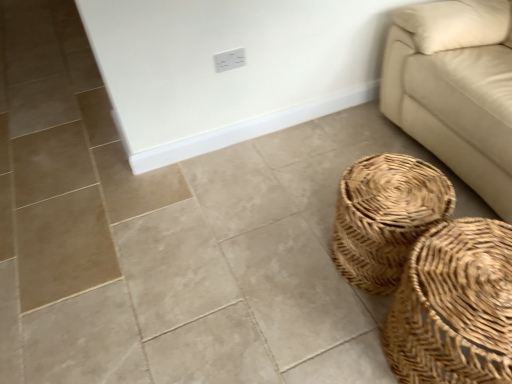
Question: Considering the relative positions of woven natural basket at lower right, which appears as the first basket when viewed from the back, and woven natural basket at lower right, which is the 1th basket from front to back, in the image provided, is woven natural basket at lower right, which appears as the first basket when viewed from the back, in front of woven natural basket at lower right, which is the 1th basket from front to back,?

Choices:
 (A) yes
 (B) no

Answer: (B)

Question: Can you confirm if woven natural basket at lower right, which appears as the first basket when viewed from the back, is positioned to the left of woven natural basket at lower right, which is the 1th basket from front to back?

Choices:
 (A) no
 (B) yes

Answer: (B)

Question: Can you confirm if woven natural basket at lower right, the second basket viewed from the front, is thinner than woven natural basket at lower right, which is the 1th basket from front to back?

Choices:
 (A) no
 (B) yes

Answer: (B)

Question: Is woven natural basket at lower right, which appears as the first basket when viewed from the back, at the right side of woven natural basket at lower right, positioned as the 2th basket in back-to-front order?

Choices:
 (A) no
 (B) yes

Answer: (A)

Question: Is woven natural basket at lower right, which appears as the first basket when viewed from the back, bigger than woven natural basket at lower right, which is the 1th basket from front to back?

Choices:
 (A) no
 (B) yes

Answer: (A)

Question: From the image's perspective, relative to beige leather couch at right, is white plastic electric outlet at upper center above or below?

Choices:
 (A) above
 (B) below

Answer: (A)

Question: Relative to beige leather couch at right, is white plastic electric outlet at upper center in front or behind?

Choices:
 (A) front
 (B) behind

Answer: (B)

Question: From a real-world perspective, is white plastic electric outlet at upper center above or below beige leather couch at right?

Choices:
 (A) above
 (B) below

Answer: (A)

Question: Considering the positions of point (215, 62) and point (436, 41), is point (215, 62) closer or farther from the camera than point (436, 41)?

Choices:
 (A) farther
 (B) closer

Answer: (A)

Question: In the image, is beige leather couch at right on the left side or the right side of woven natural basket at lower right, which is the 1th basket from front to back?

Choices:
 (A) left
 (B) right

Answer: (B)

Question: Choose the correct answer: Is beige leather couch at right inside woven natural basket at lower right, positioned as the 2th basket in back-to-front order, or outside it?

Choices:
 (A) inside
 (B) outside

Answer: (B)

Question: From a real-world perspective, is beige leather couch at right above or below woven natural basket at lower right, positioned as the 2th basket in back-to-front order?

Choices:
 (A) below
 (B) above

Answer: (B)

Question: Is point (464, 11) closer or farther from the camera than point (460, 273)?

Choices:
 (A) farther
 (B) closer

Answer: (A)

Question: Is point (360, 254) positioned closer to the camera than point (224, 51)?

Choices:
 (A) closer
 (B) farther

Answer: (A)

Question: Considering the positions of woven natural basket at lower right, which appears as the first basket when viewed from the back, and white plastic electric outlet at upper center in the image, is woven natural basket at lower right, which appears as the first basket when viewed from the back, wider or thinner than white plastic electric outlet at upper center?

Choices:
 (A) wide
 (B) thin

Answer: (A)